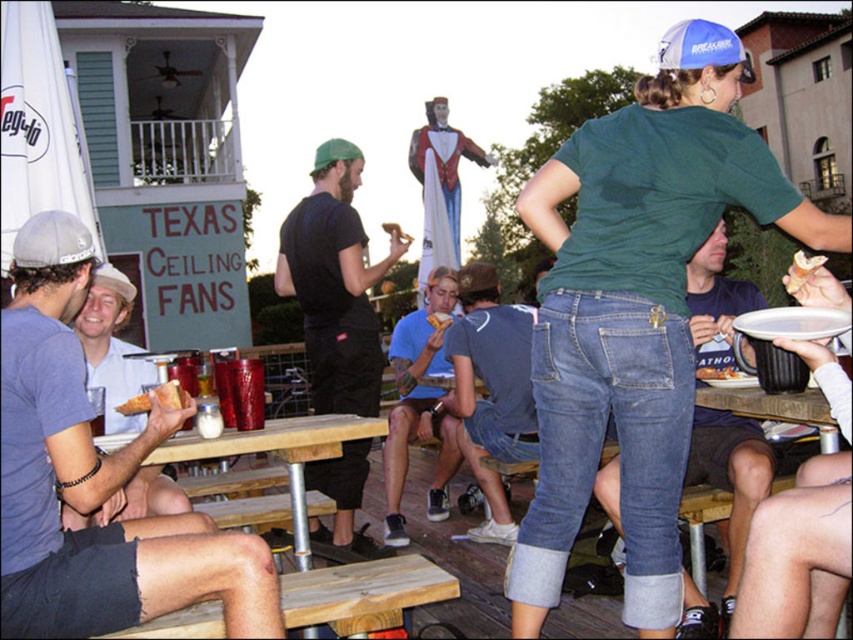
You are organizing a charity event and need to arrange seating based on clothing widths. If the denim shorts at lower right and the matte white shirt at left are placed side by side on a narrow bench, which one might require more space?

The denim shorts at lower right has a smaller width than the matte white shirt at left, so the matte white shirt at left would require more space on the bench.

You are organizing a photo shoot and need to position two models wearing the denim shorts at lower right and the matte white shirt at left. Based on the scene description, which model should you place in a wider area to accommodate their outfit?

The matte white shirt at left should be placed in a wider area since it occupies more space than the denim shorts at lower right.